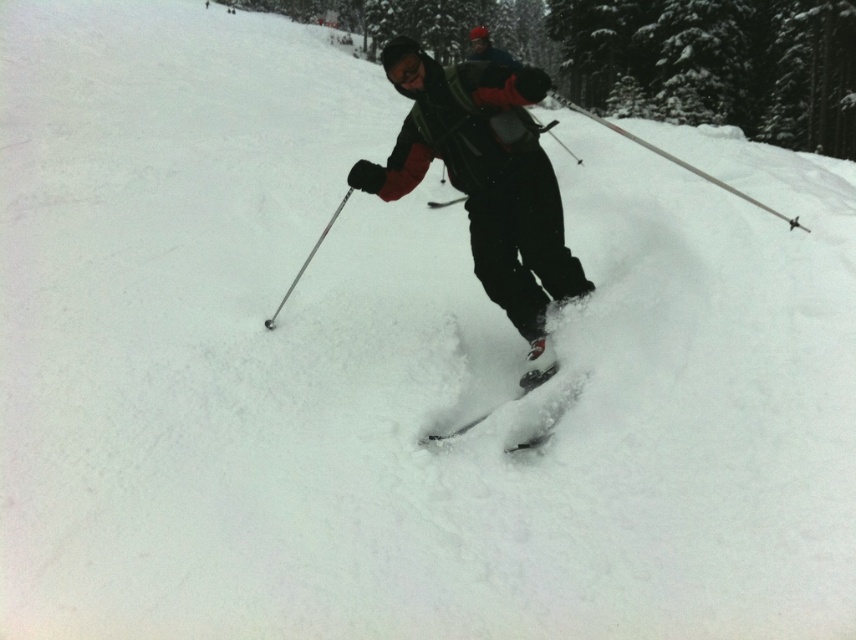
You are a photographer trying to capture the metallic silver ski pole at center and the green textured tree at center in a single photo. Based on their sizes in the scene, which object would appear larger in the photo?

The green textured tree at center would appear larger in the photo because it is much taller than the metallic silver ski pole at center.

You are a photographer capturing the skier. You notice the shiny black ski at center and the metallic silver ski pole at center. Which object is located to the right of the other?

The shiny black ski at center is positioned on the right side of metallic silver ski pole at center.